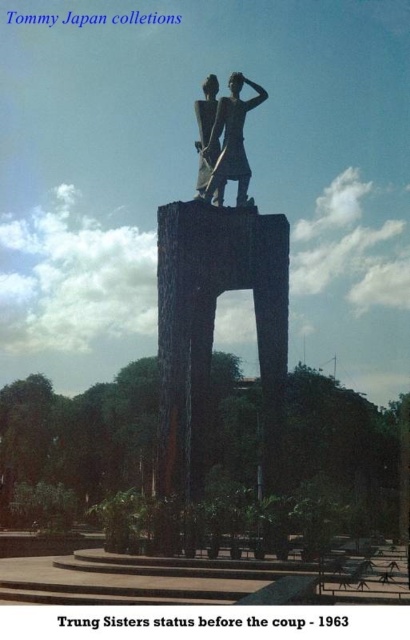
Question: Does polished bronze statue at center have a smaller size compared to bronze statue at center?

Choices:
 (A) yes
 (B) no

Answer: (B)

Question: Which is nearer to the dark gray stone statue at center?

Choices:
 (A) bronze statue at center
 (B) polished bronze statue at center

Answer: (A)

Question: Which is nearer to the polished bronze statue at center?

Choices:
 (A) dark gray stone statue at center
 (B) bronze statue at center

Answer: (B)

Question: Is polished bronze statue at center thinner than dark gray stone statue at center?

Choices:
 (A) yes
 (B) no

Answer: (B)

Question: Which point is farther to the camera?

Choices:
 (A) bronze statue at center
 (B) polished bronze statue at center

Answer: (A)

Question: Can you confirm if polished bronze statue at center is bigger than dark gray stone statue at center?

Choices:
 (A) no
 (B) yes

Answer: (B)